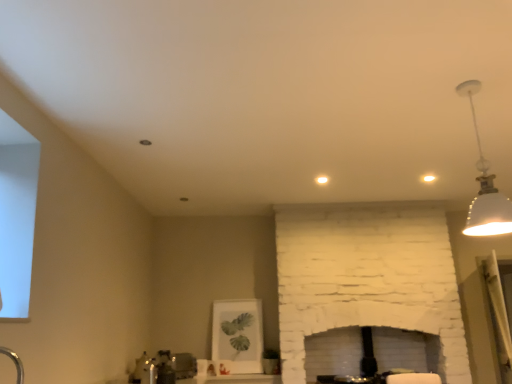
Question: Is white glossy sink at lower center next to satin nickel faucet at lower center?

Choices:
 (A) no
 (B) yes

Answer: (A)

Question: From a real-world perspective, is white glossy sink at lower center located higher than satin nickel faucet at lower center?

Choices:
 (A) yes
 (B) no

Answer: (A)

Question: Is white glossy sink at lower center further to camera compared to satin nickel faucet at lower center?

Choices:
 (A) yes
 (B) no

Answer: (A)

Question: From a real-world perspective, is white glossy sink at lower center positioned under satin nickel faucet at lower center based on gravity?

Choices:
 (A) yes
 (B) no

Answer: (B)

Question: Is white glossy sink at lower center taller than satin nickel faucet at lower center?

Choices:
 (A) no
 (B) yes

Answer: (B)

Question: Is white glossy sink at lower center shorter than satin nickel faucet at lower center?

Choices:
 (A) no
 (B) yes

Answer: (A)

Question: Can you confirm if white matte pendant light at upper right is positioned to the left of satin nickel faucet at lower center?

Choices:
 (A) no
 (B) yes

Answer: (A)

Question: Is the depth of white matte pendant light at upper right greater than that of satin nickel faucet at lower center?

Choices:
 (A) no
 (B) yes

Answer: (A)

Question: From a real-world perspective, is white matte pendant light at upper right physically below satin nickel faucet at lower center?

Choices:
 (A) no
 (B) yes

Answer: (A)

Question: Considering the relative sizes of white matte pendant light at upper right and satin nickel faucet at lower center in the image provided, is white matte pendant light at upper right shorter than satin nickel faucet at lower center?

Choices:
 (A) yes
 (B) no

Answer: (B)

Question: Is white matte pendant light at upper right taller than satin nickel faucet at lower center?

Choices:
 (A) no
 (B) yes

Answer: (B)

Question: Is white matte pendant light at upper right facing away from satin nickel faucet at lower center?

Choices:
 (A) yes
 (B) no

Answer: (B)

Question: Is white glossy sink at lower center oriented towards white matte pendant light at upper right?

Choices:
 (A) yes
 (B) no

Answer: (B)